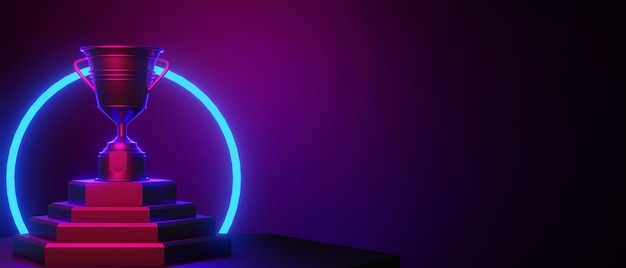
Image resolution: width=626 pixels, height=268 pixels. I want to click on table, so click(288, 256).